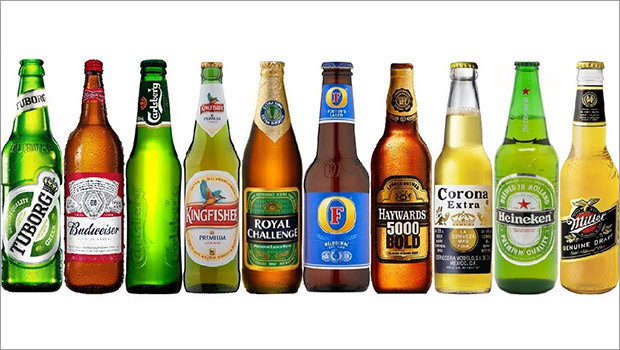
Locate an element on the screen. The width and height of the screenshot is (620, 350). beer bottles is located at coordinates (578, 251), (525, 227), (467, 227), (394, 220), (343, 224), (280, 228), (217, 236), (156, 239), (108, 228), (33, 228).